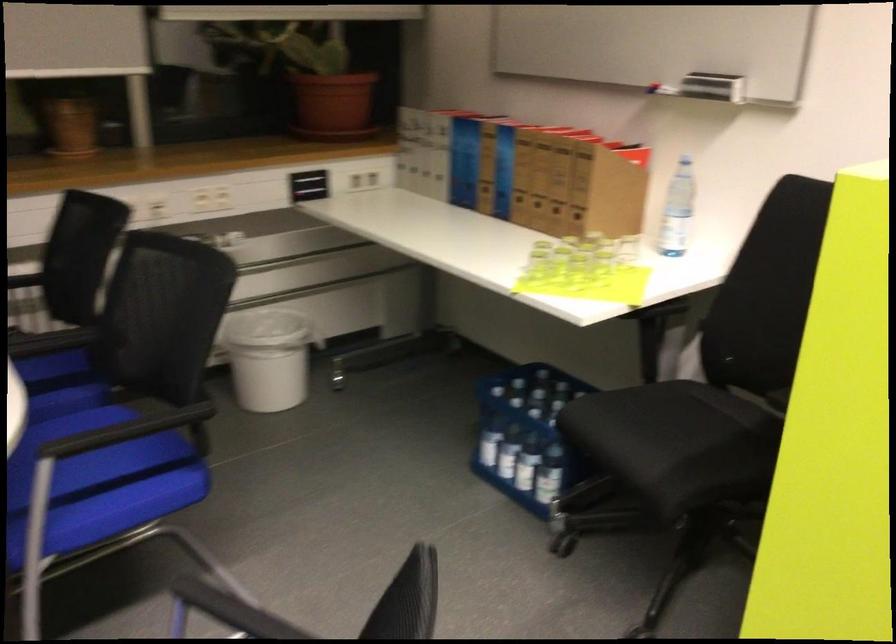
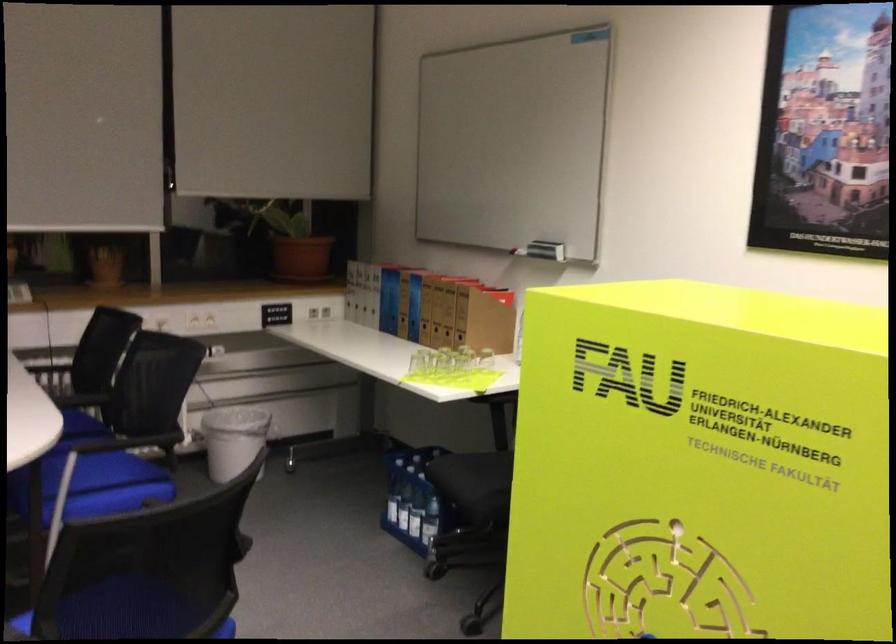
In the second image, find the point that corresponds to point (487, 436) in the first image.

(392, 500)